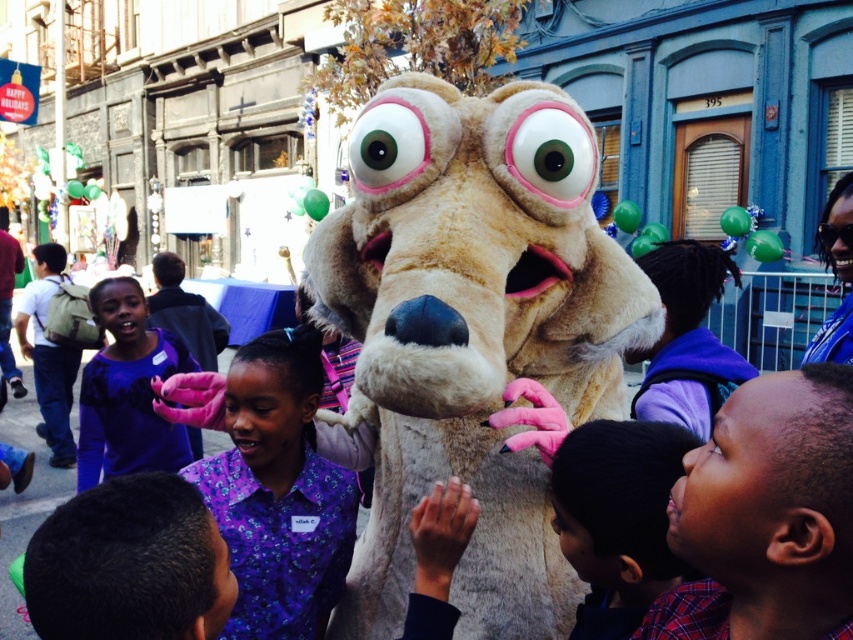
You are a photographer trying to capture both the fluffy beige costume at center and the purple floral shirt at center in a single frame. Based on their sizes, which object should you focus on first to ensure both are visible in the photo?

The fluffy beige costume at center occupies less space than purple floral shirt at center, so you should focus on the purple floral shirt at center first to ensure both are visible in the photo.

You are a photographer trying to capture a group photo of the children in the street scene. You notice two purple shirts at the center of the image. Which of the two shirts, the purple floral shirt at center or the purple fabric shirt at center, would appear narrower when viewed from your camera position?

The purple floral shirt at center is thinner than the purple fabric shirt at center, so the purple floral shirt at center would appear narrower in the photo.

You are a photographer trying to capture a photo of the fluffy beige costume at center and the smooth purple shirt at lower right. To ensure both are in focus, you need to know which object is closer to you. Which one is closer?

The fluffy beige costume at center is shorter than the smooth purple shirt at lower right, which means the smooth purple shirt at lower right is closer to you.